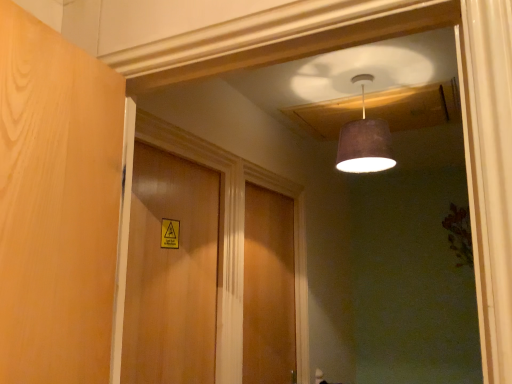
Question: Would you say wooden door at center, the first door in the right-to-left sequence, is inside or outside matte brown lampshade at upper center?

Choices:
 (A) outside
 (B) inside

Answer: (A)

Question: Is wooden door at center, placed as the first door when sorted from back to front, bigger or smaller than matte brown lampshade at upper center?

Choices:
 (A) big
 (B) small

Answer: (A)

Question: Which of these objects is positioned closest to the matte brown lampshade at upper center?

Choices:
 (A) wooden door at center, placed as the second door when sorted from right to left
 (B) wooden door at center, the first door in the right-to-left sequence

Answer: (A)

Question: Which is farther from the wooden door at center, the first door viewed from the left?

Choices:
 (A) wooden door at center, the 2th door from the front
 (B) matte brown lampshade at upper center

Answer: (B)